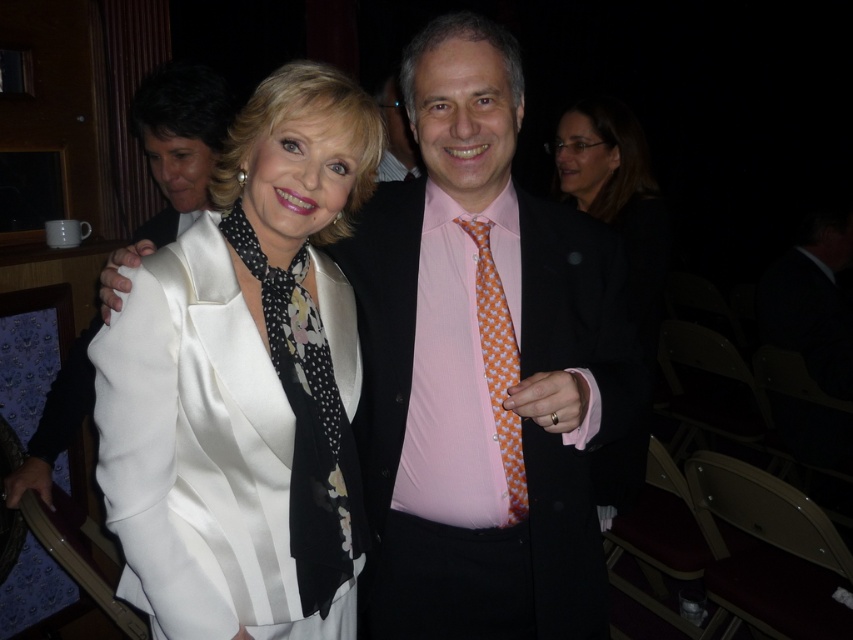
Who is more forward, (590, 417) or (387, 172)?

Point (590, 417) is more forward.

This screenshot has height=640, width=853. What do you see at coordinates (485, 368) in the screenshot? I see `satin white suit at center` at bounding box center [485, 368].

Identify the location of satin white suit at center. The image size is (853, 640). (485, 368).

Image resolution: width=853 pixels, height=640 pixels. Find the location of `satin white suit at center`. satin white suit at center is located at coordinates (485, 368).

Does point (641, 474) come farther from viewer compared to point (540, 352)?

Yes.

Find the location of a particular element. satin white suit at center is located at coordinates (485, 368).

Who is more distant from viewer, (x=434, y=177) or (x=579, y=474)?

The point (x=579, y=474) is behind.

Where is `satin white suit at center`? The width and height of the screenshot is (853, 640). satin white suit at center is located at coordinates (485, 368).

Does satin white suit at center appear under satin white dress at center?

Incorrect, satin white suit at center is not positioned below satin white dress at center.

Measure the distance between satin white suit at center and satin white dress at center.

A distance of 10.55 inches exists between satin white suit at center and satin white dress at center.

The width and height of the screenshot is (853, 640). In order to click on satin white suit at center in this screenshot , I will do `click(485, 368)`.

Locate an element on the screen. Image resolution: width=853 pixels, height=640 pixels. satin white suit at center is located at coordinates (485, 368).